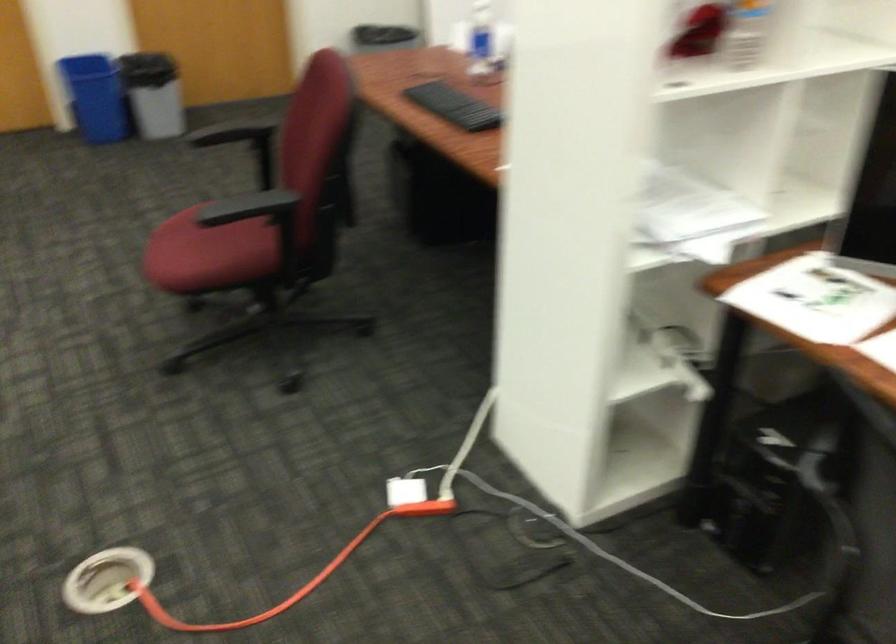
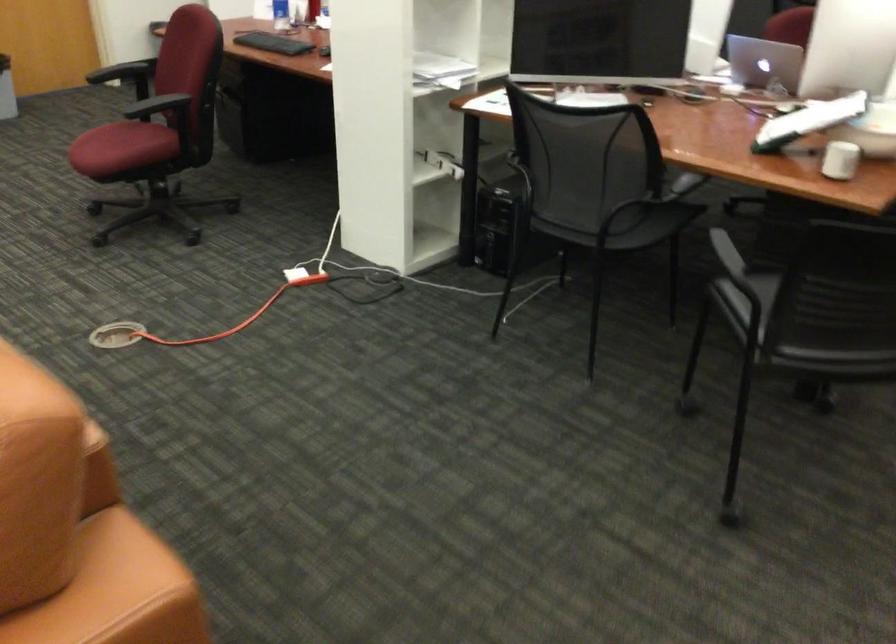
In the second image, find the point that corresponds to point (674, 372) in the first image.

(444, 163)